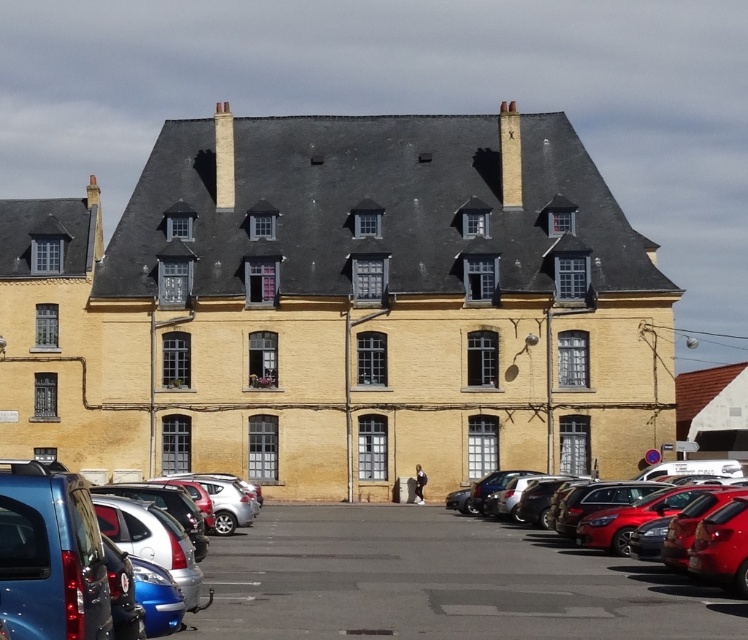
Describe the element at coordinates (438, 582) in the screenshot. I see `metallic silver car at lower left` at that location.

Is metallic silver car at lower left above shiny blue sedan at lower left?

No.

Which is in front, point (410, 596) or point (79, 589)?

Point (79, 589) is more forward.

Identify the location of metallic silver car at lower left. (438, 582).

Between shiny blue sedan at lower left and shiny red car at lower right, which one has less height?

Standing shorter between the two is shiny red car at lower right.

What do you see at coordinates (49, 556) in the screenshot? The width and height of the screenshot is (748, 640). I see `shiny blue sedan at lower left` at bounding box center [49, 556].

This screenshot has height=640, width=748. In order to click on shiny blue sedan at lower left in this screenshot , I will do `click(49, 556)`.

Is metallic silver car at lower left above shiny red car at lower right?

Incorrect, metallic silver car at lower left is not positioned above shiny red car at lower right.

Between point (260, 550) and point (595, 497), which one is positioned in front?

Positioned in front is point (595, 497).

Where is `metallic silver car at lower left`? metallic silver car at lower left is located at coordinates (438, 582).